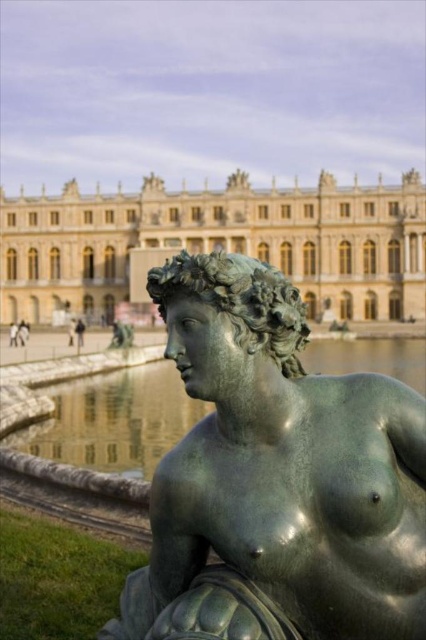
Where is `bronze/golden-yellow palace at upper center`? bronze/golden-yellow palace at upper center is located at coordinates (215, 244).

Is point (86, 237) positioned after point (60, 442)?

Yes, it is.

Find the location of a particular element. The height and width of the screenshot is (640, 426). bronze/golden-yellow palace at upper center is located at coordinates (215, 244).

This screenshot has width=426, height=640. What do you see at coordinates (276, 477) in the screenshot?
I see `green patina statue at center` at bounding box center [276, 477].

Is green patina statue at center to the left of green reflective water at statue right from the viewer's perspective?

Yes, green patina statue at center is to the left of green reflective water at statue right.

Does point (207, 625) come behind point (201, 410)?

No, (207, 625) is closer to viewer.

The width and height of the screenshot is (426, 640). I want to click on green patina statue at center, so click(x=276, y=477).

Can you confirm if green patina statue at center is positioned to the left of bronze/golden-yellow palace at upper center?

In fact, green patina statue at center is to the right of bronze/golden-yellow palace at upper center.

Where is `green patina statue at center`? The image size is (426, 640). green patina statue at center is located at coordinates (276, 477).